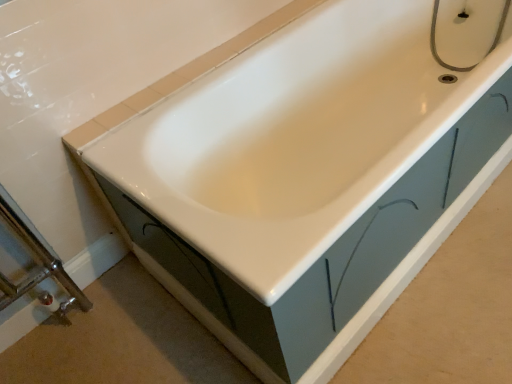
Question: Does brushed metal shower door at lower left have a larger size compared to matte silver faucet at upper right?

Choices:
 (A) no
 (B) yes

Answer: (B)

Question: Is brushed metal shower door at lower left smaller than matte silver faucet at upper right?

Choices:
 (A) no
 (B) yes

Answer: (A)

Question: Can you confirm if brushed metal shower door at lower left is wider than matte silver faucet at upper right?

Choices:
 (A) no
 (B) yes

Answer: (A)

Question: Is the position of brushed metal shower door at lower left less distant than that of matte silver faucet at upper right?

Choices:
 (A) yes
 (B) no

Answer: (A)

Question: Is brushed metal shower door at lower left facing away from matte silver faucet at upper right?

Choices:
 (A) no
 (B) yes

Answer: (A)

Question: From a real-world perspective, is brushed metal shower door at lower left on matte silver faucet at upper right?

Choices:
 (A) yes
 (B) no

Answer: (B)

Question: Can you confirm if matte silver faucet at upper right is wider than brushed metal shower door at lower left?

Choices:
 (A) yes
 (B) no

Answer: (A)

Question: Considering the relative sizes of matte silver faucet at upper right and brushed metal shower door at lower left in the image provided, is matte silver faucet at upper right bigger than brushed metal shower door at lower left?

Choices:
 (A) yes
 (B) no

Answer: (B)

Question: Is matte silver faucet at upper right at the left side of brushed metal shower door at lower left?

Choices:
 (A) no
 (B) yes

Answer: (A)

Question: Is the depth of matte silver faucet at upper right less than that of brushed metal shower door at lower left?

Choices:
 (A) yes
 (B) no

Answer: (B)

Question: Is brushed metal shower door at lower left a part of matte silver faucet at upper right?

Choices:
 (A) yes
 (B) no

Answer: (B)

Question: Considering the relative sizes of matte silver faucet at upper right and brushed metal shower door at lower left in the image provided, is matte silver faucet at upper right shorter than brushed metal shower door at lower left?

Choices:
 (A) yes
 (B) no

Answer: (A)

Question: Is point (11, 240) closer or farther from the camera than point (435, 16)?

Choices:
 (A) closer
 (B) farther

Answer: (A)